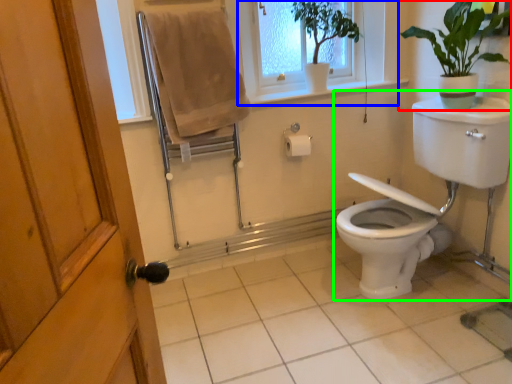
Question: Based on their relative distances, which object is nearer to houseplant (highlighted by a red box)? Choose from window frame (highlighted by a blue box) and sink (highlighted by a green box).

Choices:
 (A) window frame
 (B) sink

Answer: (B)